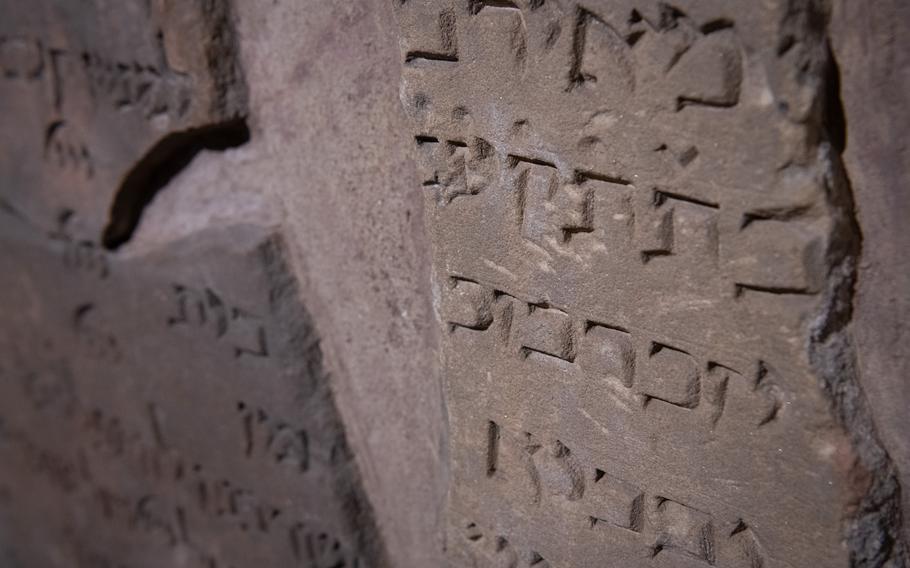
Identify the location of right of tablet. (881, 151).